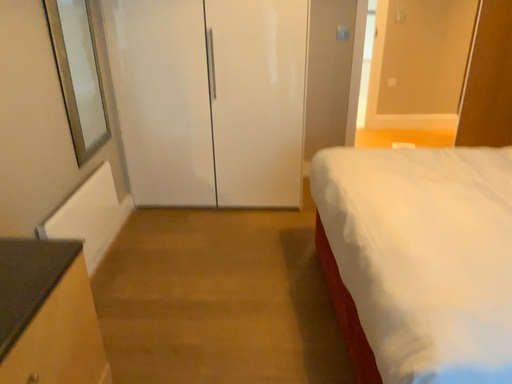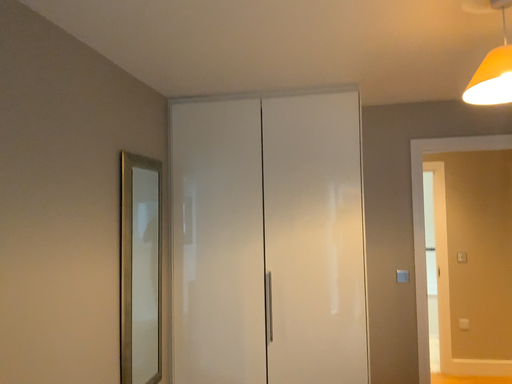
Question: How did the camera likely rotate when shooting the video?

Choices:
 (A) rotated downward
 (B) rotated upward

Answer: (B)